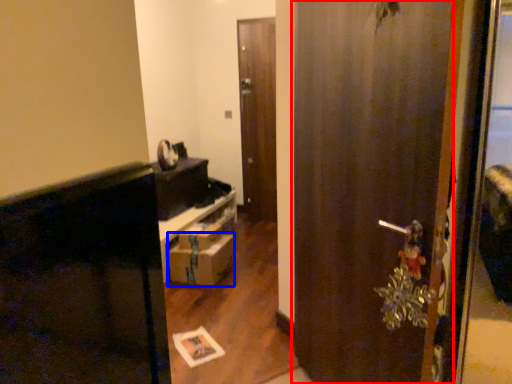
Question: Which point is closer to the camera, door (highlighted by a red box) or drawer (highlighted by a blue box)?

Choices:
 (A) door
 (B) drawer

Answer: (A)